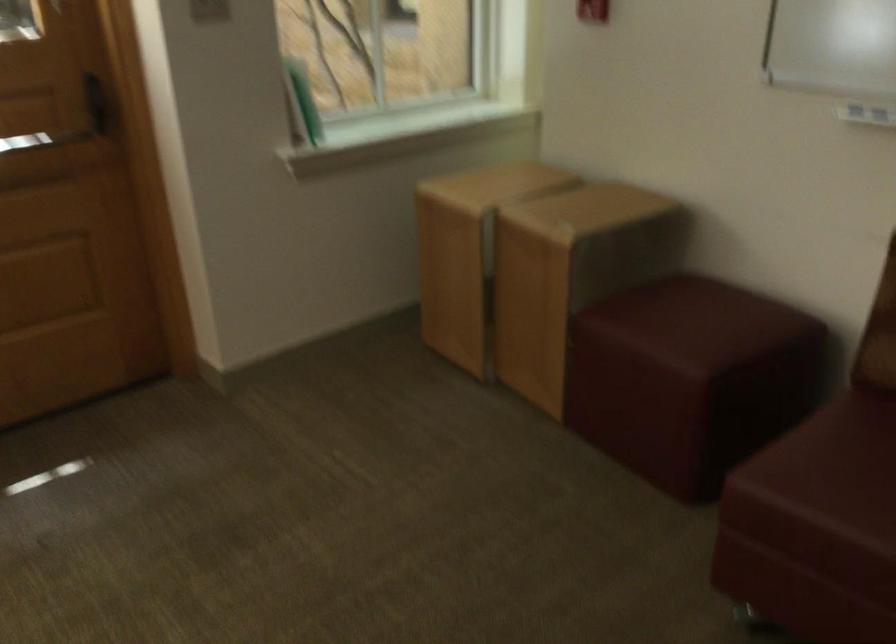
In order to click on maroon sitting surface in this screenshot , I will do `click(693, 325)`.